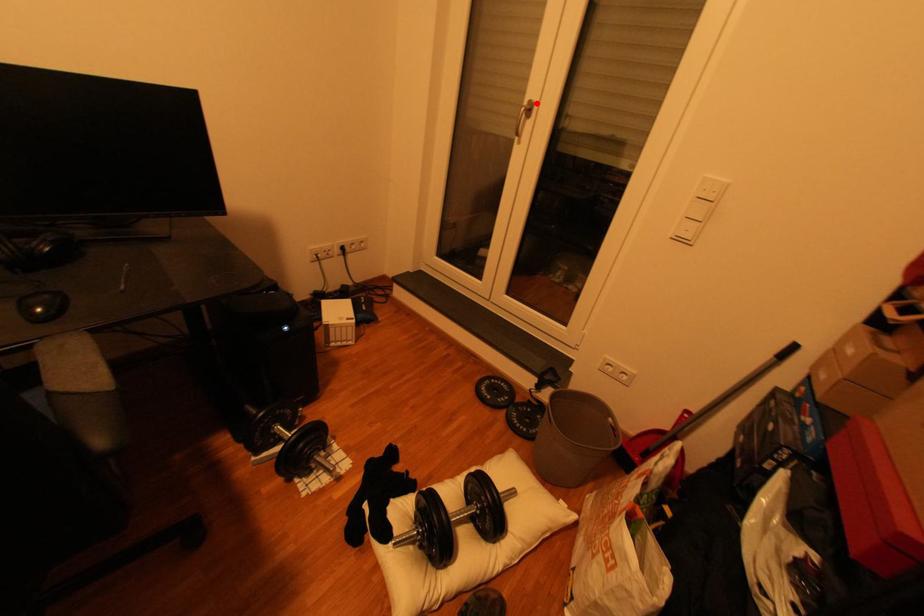
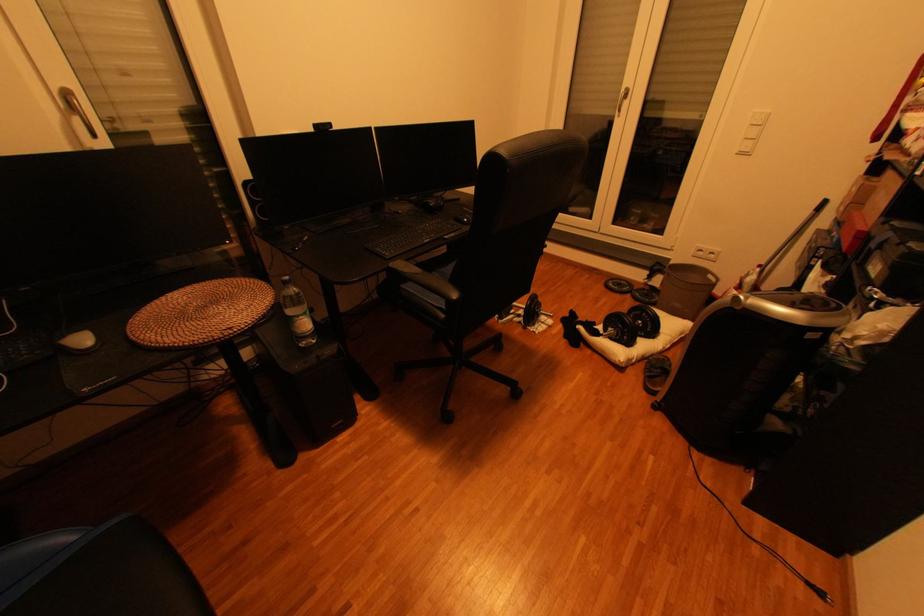
Question: I am providing you with two images of the same scene from different viewpoints. A red point is marked on the first image. Can you still see the location of the red point in image 2?

Choices:
 (A) Yes
 (B) No

Answer: (A)